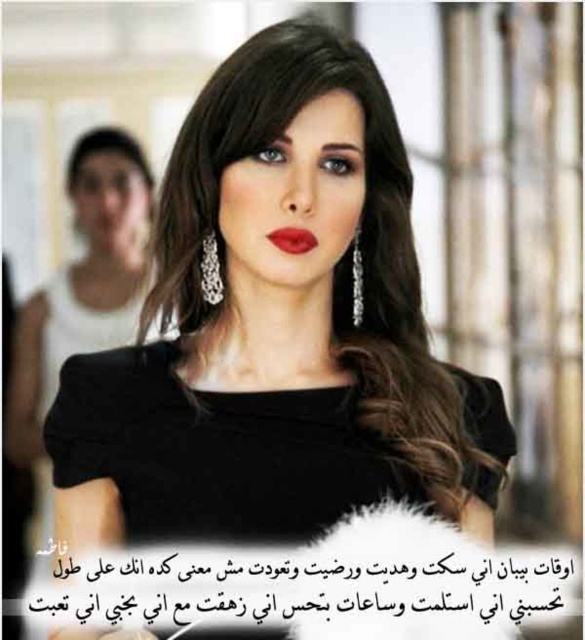
Question: Does black matte dress at center have a larger size compared to silver metallic earring at center?

Choices:
 (A) no
 (B) yes

Answer: (B)

Question: Does black matte dress at center appear over silver metallic earring at center?

Choices:
 (A) no
 (B) yes

Answer: (A)

Question: Which is farther from the matte red lips at center?

Choices:
 (A) shiny dark brown hair at center
 (B) silver metallic earring at center
 (C) black shiny hair at upper left
 (D) silver metallic earring at upper center

Answer: (C)

Question: Can you confirm if black matte dress at center is positioned to the right of black shiny hair at upper left?

Choices:
 (A) no
 (B) yes

Answer: (B)

Question: Which point is farther from the camera taking this photo?

Choices:
 (A) (211, 472)
 (B) (102, 561)
 (C) (428, 420)
 (D) (352, 252)

Answer: (D)

Question: Which is farther from the matte red lips at center?

Choices:
 (A) black shiny hair at upper left
 (B) silver metallic earring at center
 (C) shiny dark brown hair at center

Answer: (A)